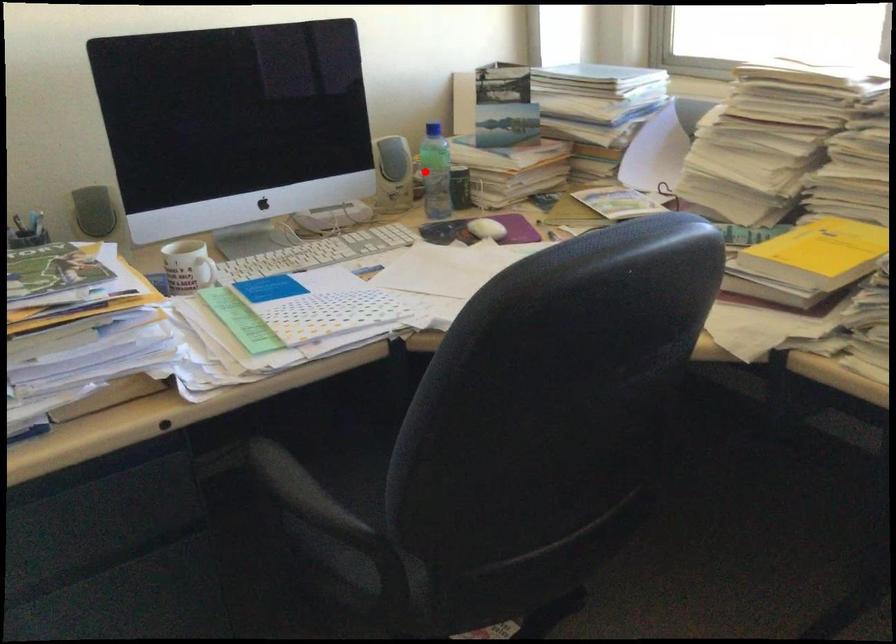
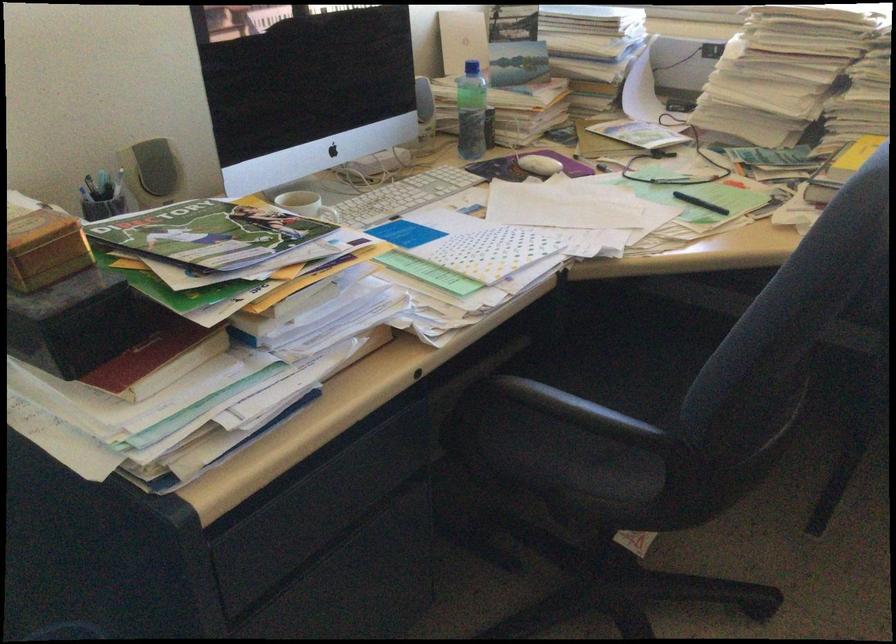
The point at the highlighted location is marked in the first image. Where is the corresponding point in the second image?

(470, 111)